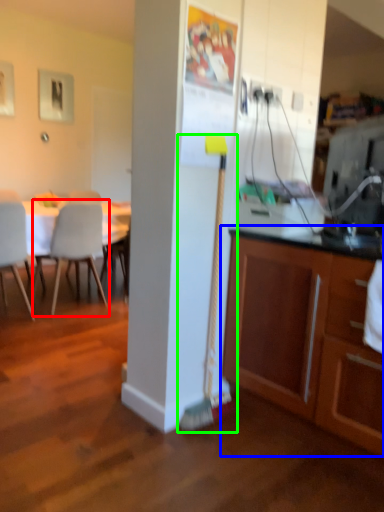
Question: Which object is positioned farthest from chair (highlighted by a red box)? Select from cabinetry (highlighted by a blue box) and brush (highlighted by a green box).

Choices:
 (A) cabinetry
 (B) brush

Answer: (A)